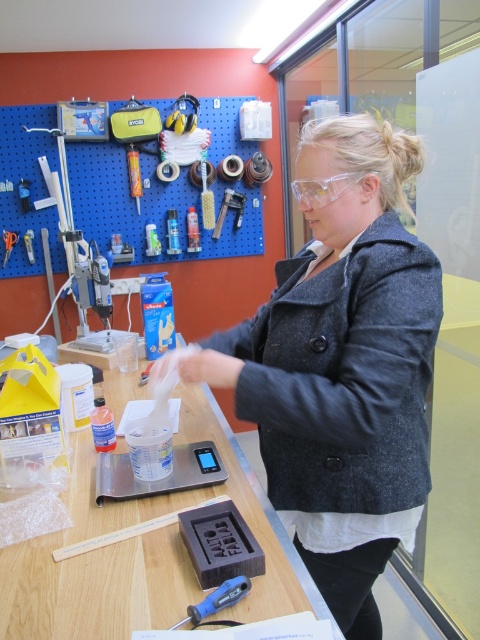
Is blue plastic screwdriver at lower center shorter than brushed metal screwdriver at center?

Yes, blue plastic screwdriver at lower center is shorter than brushed metal screwdriver at center.

Who is more forward, (225,598) or (7,248)?

Point (225,598) is in front.

Locate an element on the screen. Image resolution: width=480 pixels, height=640 pixels. blue plastic screwdriver at lower center is located at coordinates (216, 600).

The height and width of the screenshot is (640, 480). What are the coordinates of `blue plastic screwdriver at lower center` in the screenshot? It's located at tap(216, 600).

Can you confirm if metallic silver scale at center is shorter than blue plastic screwdriver at lower center?

No, metallic silver scale at center is not shorter than blue plastic screwdriver at lower center.

Between metallic silver scale at center and blue plastic screwdriver at lower center, which one appears on the right side from the viewer's perspective?

blue plastic screwdriver at lower center

Where is `metallic silver scale at center`? metallic silver scale at center is located at coordinates (162, 477).

Does metallic silver scale at center have a greater width compared to transparent plastic goggles at center?

Indeed, metallic silver scale at center has a greater width compared to transparent plastic goggles at center.

Between point (141, 497) and point (334, 176), which one is positioned in front?

Positioned in front is point (334, 176).

Which is in front, point (135, 493) or point (303, 195)?

Point (303, 195)

Where is `metallic silver scale at center`? The image size is (480, 640). metallic silver scale at center is located at coordinates pyautogui.click(x=162, y=477).